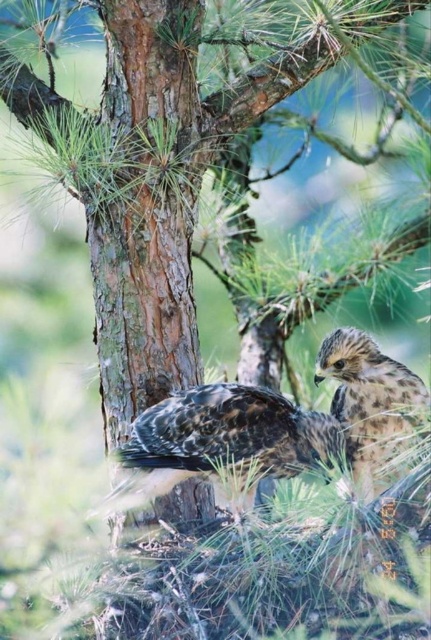
You are a wildlife photographer aiming to capture a closeup of the speckled brown eagle at right without disturbing the brown speckled feathers at center. Given their size difference, which bird should you focus on first to ensure both are in frame?

The brown speckled feathers at center has a larger size compared to the speckled brown eagle at right, so you should focus on the brown speckled feathers at center first to ensure both are in frame.

You are a wildlife photographer trying to capture a closeup of the brown speckled feathers at center. Your camera has a focus point at coordinate point (224, 442). Will this focus point align with the brown speckled feathers at center?

The brown speckled feathers at center is located at point (224, 442), so yes, the focus point at coordinate point (224, 442) will align with the brown speckled feathers at center.

You are a wildlife photographer aiming to capture a closeup of the hawks on the pine tree. You are currently positioned at the camera location. There is a point at coordinates point [214,413] that is 7.85 feet away from your current position. If you want to get closer to the hawks without moving your camera, which direction should you move towards?

You should move towards the point [214,413] because it is 7.85 feet away from your current position, so moving in that direction will bring you closer to the hawks.